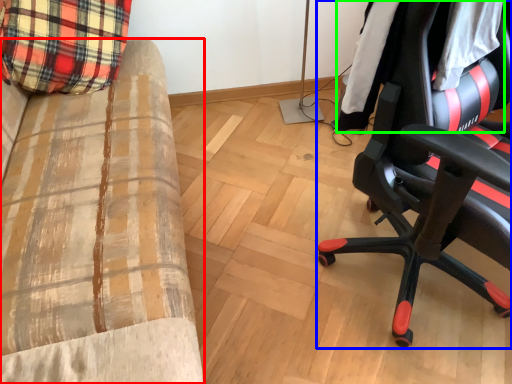
Question: Which object is the farthest from furniture (highlighted by a red box)? Choose among these: chair (highlighted by a blue box) or clothing (highlighted by a green box).

Choices:
 (A) chair
 (B) clothing

Answer: (B)